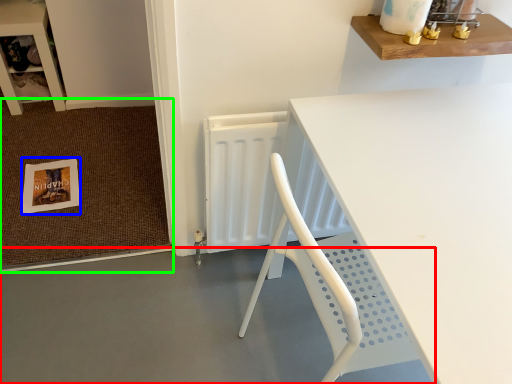
Question: Based on their relative distances, which object is farther from concrete (highlighted by a red box)? Choose from postcard (highlighted by a blue box) and doormat (highlighted by a green box).

Choices:
 (A) postcard
 (B) doormat

Answer: (A)